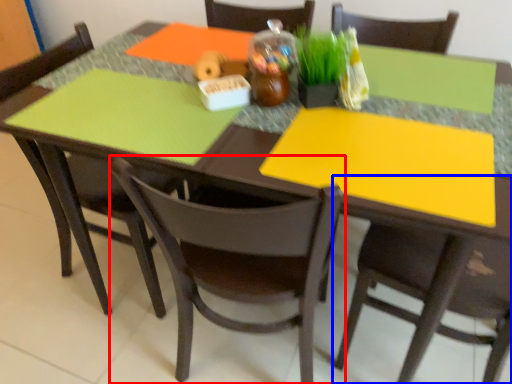
Question: Which point is closer to the camera, chair (highlighted by a red box) or chair (highlighted by a blue box)?

Choices:
 (A) chair
 (B) chair

Answer: (B)